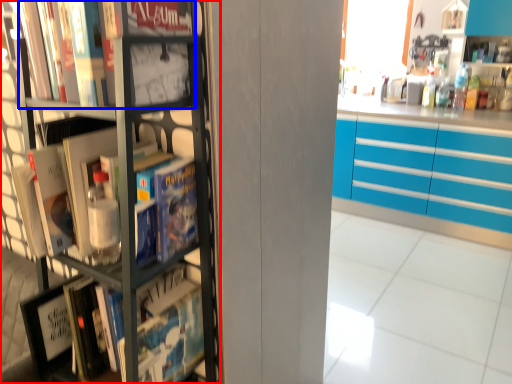
Question: Which object appears farthest to the camera in this image, bookcase (highlighted by a red box) or book (highlighted by a blue box)?

Choices:
 (A) bookcase
 (B) book

Answer: (B)